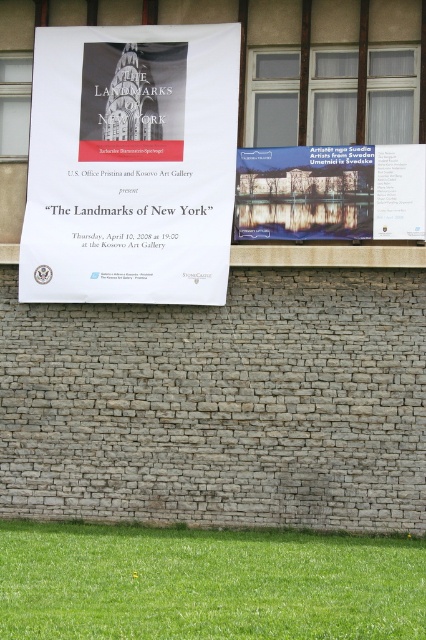
Question: Can you confirm if white paper poster at upper center is smaller than green grass at lower center?

Choices:
 (A) no
 (B) yes

Answer: (A)

Question: Which object is closer to the camera taking this photo?

Choices:
 (A) white paper poster at upper center
 (B) matte paper poster at center

Answer: (B)

Question: Is white paper poster at upper center to the right of matte paper poster at center from the viewer's perspective?

Choices:
 (A) yes
 (B) no

Answer: (B)

Question: Which of the following is the farthest from the observer?

Choices:
 (A) (371, 618)
 (B) (164, 253)

Answer: (B)

Question: Estimate the real-world distances between objects in this image. Which object is farther from the white paper poster at upper center?

Choices:
 (A) matte paper poster at center
 (B) green grass at lower center

Answer: (B)

Question: Can you confirm if white paper poster at upper center is positioned to the left of green grass at lower center?

Choices:
 (A) no
 (B) yes

Answer: (B)